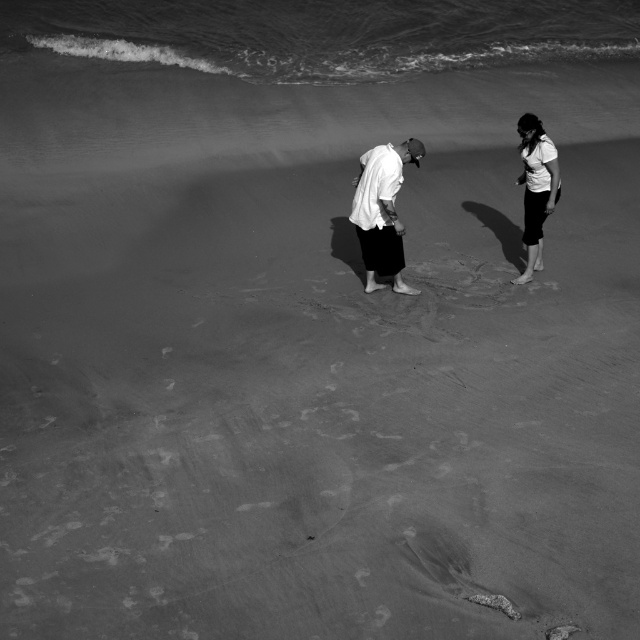
You are standing at the shoreline of the beach in the image. You see two points marked on the sand. The first point is at coordinates point (372, 182) and the second point is at point (516, 132). Which point is closer to you?

Point (372, 182) is closer to the viewer than point (516, 132).